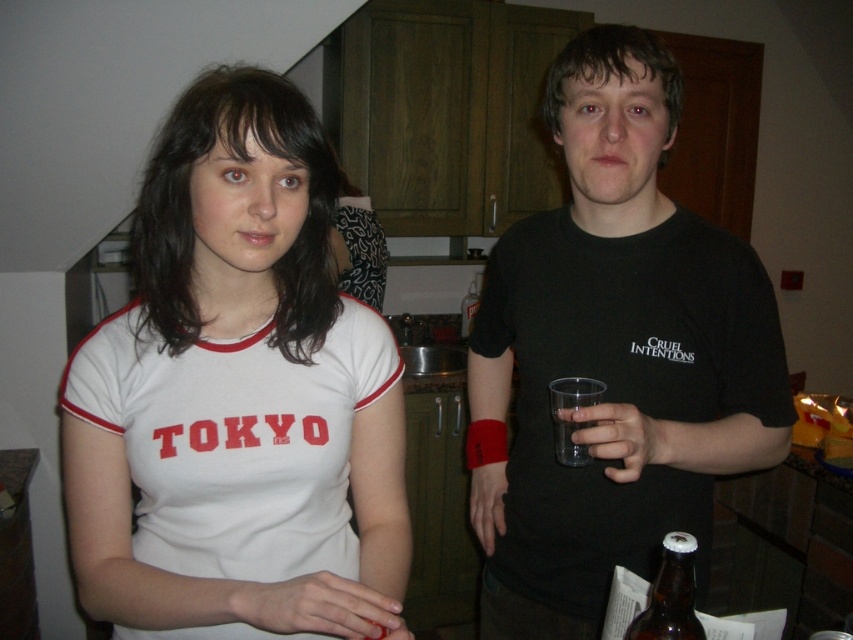
Question: Is white cotton shirt at center thinner than brown glass bottle at lower right?

Choices:
 (A) no
 (B) yes

Answer: (A)

Question: Which of the following is the closest to the observer?

Choices:
 (A) (711, 316)
 (B) (567, 432)

Answer: (B)

Question: Observing the image, what is the correct spatial positioning of black matte t-shirt at center in reference to brown glass bottle at lower right?

Choices:
 (A) below
 (B) above

Answer: (B)

Question: Considering the relative positions of white cotton shirt at center and brown glass bottle at lower right in the image provided, where is white cotton shirt at center located with respect to brown glass bottle at lower right?

Choices:
 (A) right
 (B) left

Answer: (B)

Question: Which is nearer to the black matte t-shirt at center?

Choices:
 (A) white cotton shirt at center
 (B) brown glass bottle at lower right
 (C) transparent plastic cup at center-right

Answer: (C)

Question: Which object is farther from the camera taking this photo?

Choices:
 (A) transparent plastic cup at center
 (B) clear plastic cup at right
 (C) brown glass bottle at lower right
 (D) white cotton shirt at center

Answer: (B)